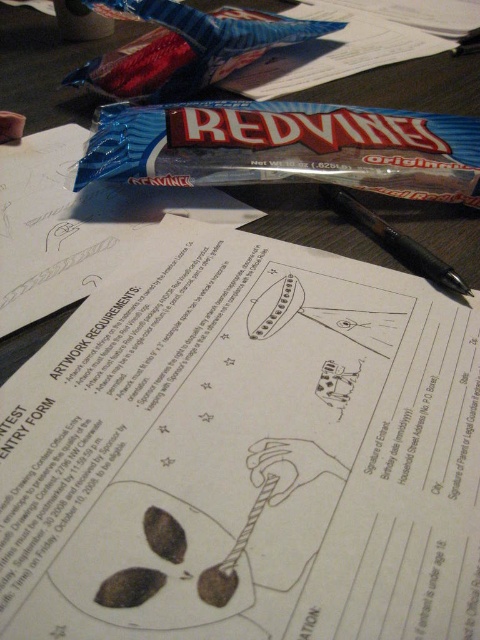
Is white paper at center further to camera compared to black plastic pen at center?

No, it is not.

Is point (300, 573) in front of point (337, 200)?

Yes, point (300, 573) is closer to viewer.

Is point (324, 406) positioned before point (393, 236)?

That is True.

The height and width of the screenshot is (640, 480). I want to click on white paper at center, so click(244, 452).

Can you confirm if blue shiny candy at center is positioned to the right of blue foil wrapped candy bar at upper center?

Correct, you'll find blue shiny candy at center to the right of blue foil wrapped candy bar at upper center.

Consider the image. Is blue shiny candy at center shorter than blue foil wrapped candy bar at upper center?

Indeed, blue shiny candy at center has a lesser height compared to blue foil wrapped candy bar at upper center.

Is point (211, 148) positioned before point (103, 83)?

Yes, it is.

At what (x,y) coordinates should I click in order to perform the action: click on blue shiny candy at center. Please return your answer as a coordinate pair (x, y). Image resolution: width=480 pixels, height=640 pixels. Looking at the image, I should click on (287, 147).

Is blue foil wrapped candy bar at upper center closer to camera compared to black plastic pen at center?

No, blue foil wrapped candy bar at upper center is further to the viewer.

Between blue foil wrapped candy bar at upper center and black plastic pen at center, which one has less height?

With less height is black plastic pen at center.

Does point (142, 45) lie in front of point (424, 266)?

That is False.

At what (x,y) coordinates should I click in order to perform the action: click on blue foil wrapped candy bar at upper center. Please return your answer as a coordinate pair (x, y). The image size is (480, 640). Looking at the image, I should click on (187, 48).